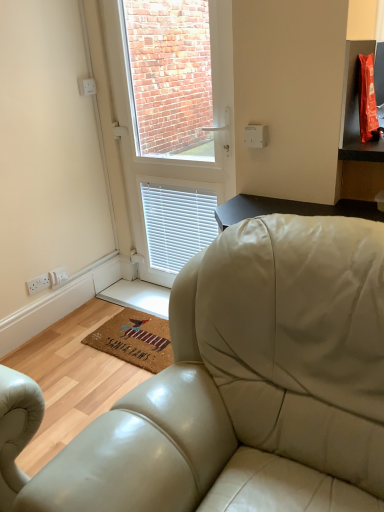
This screenshot has height=512, width=384. Find the location of `white plastic window at center`. white plastic window at center is located at coordinates (177, 154).

What do you see at coordinates (177, 154) in the screenshot?
I see `white plastic window at center` at bounding box center [177, 154].

The height and width of the screenshot is (512, 384). I want to click on white plastic socket at lower left, so click(x=39, y=283).

In order to click on white plastic window at center in this screenshot , I will do `click(177, 154)`.

Is white plastic socket at lower left turned away from brown coir mat at lower center?

No, brown coir mat at lower center is not at the back of white plastic socket at lower left.

Considering the relative sizes of white plastic socket at lower left and brown coir mat at lower center in the image provided, is white plastic socket at lower left bigger than brown coir mat at lower center?

Actually, white plastic socket at lower left might be smaller than brown coir mat at lower center.

Can you confirm if white plastic socket at lower left is positioned to the right of brown coir mat at lower center?

Incorrect, white plastic socket at lower left is not on the right side of brown coir mat at lower center.

From a real-world perspective, who is located higher, white plastic socket at lower left or brown coir mat at lower center?

white plastic socket at lower left, from a real-world perspective.

Relative to white plastic window at center, is white plastic socket at lower left in front or behind?

white plastic socket at lower left is behind white plastic window at center.

Looking at this image, is white plastic socket at lower left outside of white plastic window at center?

white plastic socket at lower left is positioned outside white plastic window at center.

Does white plastic socket at lower left turn towards white plastic window at center?

No, white plastic socket at lower left does not turn towards white plastic window at center.

In the scene shown: From a real-world perspective, is white plastic window at center physically located above or below brown coir mat at lower center?

white plastic window at center is situated higher than brown coir mat at lower center in the real world.

From the image's perspective, which one is positioned lower, white plastic window at center or brown coir mat at lower center?

brown coir mat at lower center.

Does white plastic window at center turn towards brown coir mat at lower center?

Yes, white plastic window at center is facing brown coir mat at lower center.

Is point (231, 67) farther from camera compared to point (141, 331)?

That is False.

Which of these two, white plastic window at center or white plastic socket at lower left, is bigger?

white plastic window at center is bigger.

Which object is wider, white plastic window at center or white plastic socket at lower left?

With larger width is white plastic window at center.

Is point (222, 135) closer to viewer compared to point (39, 281)?

Yes, point (222, 135) is in front of point (39, 281).

Is brown coir mat at lower center to the right of white plastic socket at lower left from the viewer's perspective?

Yes, brown coir mat at lower center is to the right of white plastic socket at lower left.

Considering the points (156, 360) and (33, 294), which point is in front, point (156, 360) or point (33, 294)?

Positioned in front is point (156, 360).

Is brown coir mat at lower center facing towards white plastic socket at lower left?

No, brown coir mat at lower center is not aimed at white plastic socket at lower left.

Is brown coir mat at lower center facing away from white plastic window at center?

No.

Locate an element on the screen. The image size is (384, 512). mat below the white plastic window at center (from a real-world perspective) is located at coordinates (135, 339).

From the image's perspective, which is above, brown coir mat at lower center or white plastic window at center?

white plastic window at center is shown above in the image.

I want to click on mat below the white plastic socket at lower left (from the image's perspective), so click(135, 339).

Where is `electric outlet behind the white plastic window at center`? This screenshot has height=512, width=384. electric outlet behind the white plastic window at center is located at coordinates tap(39, 283).

Based on their spatial positions, is white plastic socket at lower left or white plastic window at center closer to brown coir mat at lower center?

The object closer to brown coir mat at lower center is white plastic socket at lower left.

Estimate the real-world distances between objects in this image. Which object is further from brown coir mat at lower center, white plastic window at center or white plastic socket at lower left?

Based on the image, white plastic window at center appears to be further to brown coir mat at lower center.

Estimate the real-world distances between objects in this image. Which object is further from white plastic window at center, brown coir mat at lower center or white plastic socket at lower left?

white plastic socket at lower left lies further to white plastic window at center than the other object.

Estimate the real-world distances between objects in this image. Which object is closer to white plastic socket at lower left, white plastic window at center or brown coir mat at lower center?

brown coir mat at lower center.

When comparing their distances from white plastic socket at lower left, does brown coir mat at lower center or white plastic window at center seem further?

white plastic window at center.

Based on their spatial positions, is white plastic socket at lower left or brown coir mat at lower center closer to white plastic window at center?

Among the two, brown coir mat at lower center is located nearer to white plastic window at center.

Find the location of a particular element. This screenshot has width=384, height=512. electric outlet that lies between white plastic window at center and brown coir mat at lower center from top to bottom is located at coordinates (x=39, y=283).